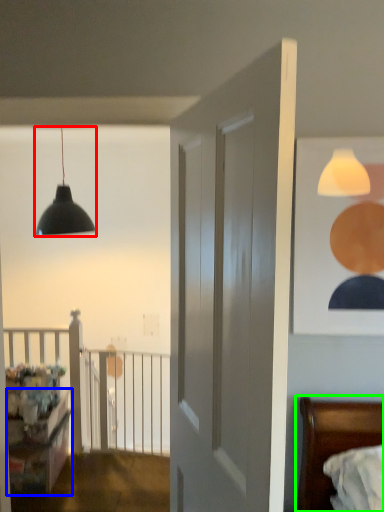
Question: Considering the real-world distances, which object is closest to lamp (highlighted by a red box)? dresser (highlighted by a blue box) or bed (highlighted by a green box).

Choices:
 (A) dresser
 (B) bed

Answer: (A)